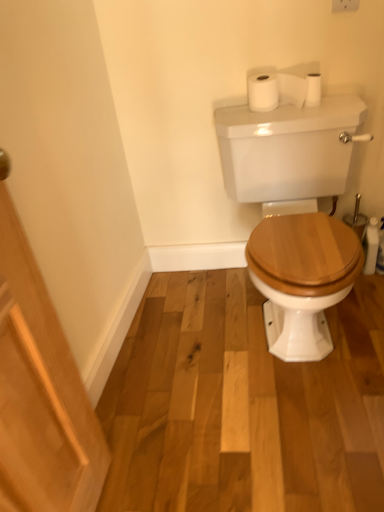
Find the location of a particular element. vacant space to the left of white matte toilet paper at upper right, the first toilet paper when ordered from right to left is located at coordinates (273, 115).